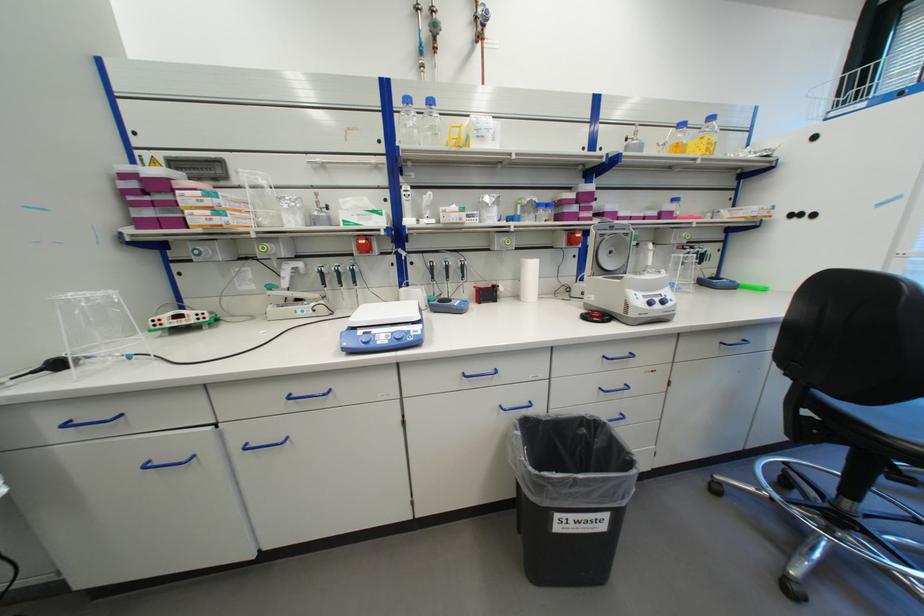
Find where to clos the centrifuge lid. Please return your answer as a coordinate pair (x, y).

(610, 252)